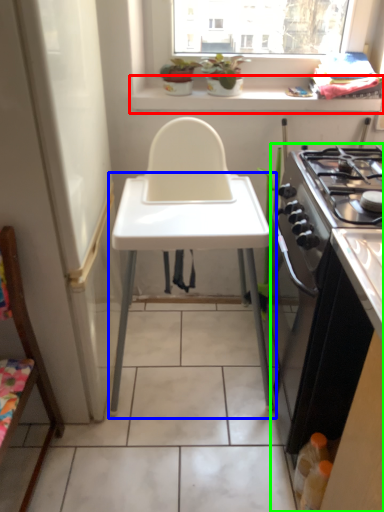
Question: Which object is the farthest from window sill (highlighted by a red box)? Choose among these: changing table (highlighted by a blue box) or cabinetry (highlighted by a green box).

Choices:
 (A) changing table
 (B) cabinetry

Answer: (B)